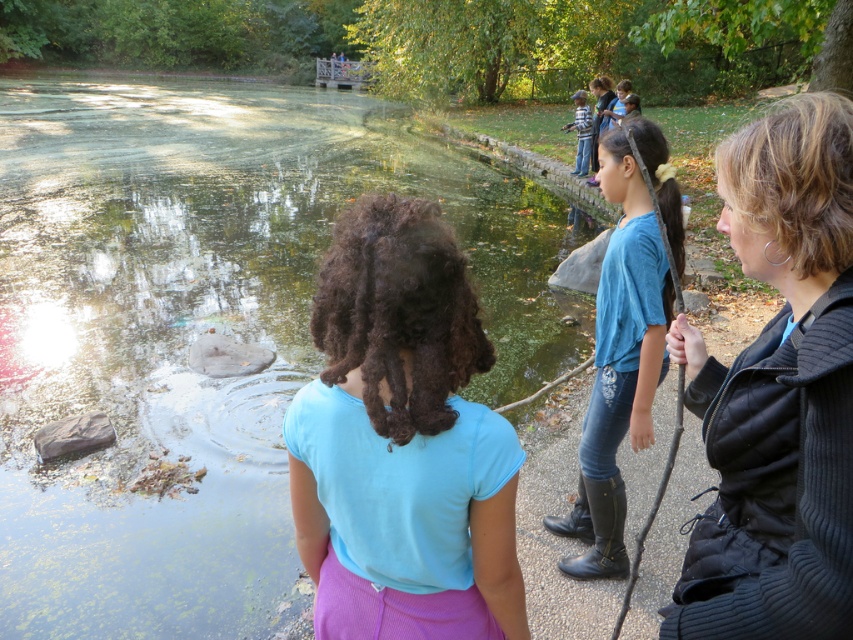
Question: Which object is closer to the camera taking this photo?

Choices:
 (A) blue denim jeans at upper center
 (B) black fuzzy jacket at upper right

Answer: (B)

Question: Considering the relative positions of blue fabric shirt at center and blue denim jeans at upper right in the image provided, where is blue fabric shirt at center located with respect to blue denim jeans at upper right?

Choices:
 (A) above
 (B) below

Answer: (A)

Question: Observing the image, what is the correct spatial positioning of green algae-covered water at center in reference to blue denim jeans at upper center?

Choices:
 (A) above
 (B) below

Answer: (A)

Question: Which object appears farthest from the camera in this image?

Choices:
 (A) blue fabric shirt at center
 (B) green algae-covered water at center

Answer: (B)

Question: In this image, where is blue fabric shirt at center located relative to blue denim jeans at upper right?

Choices:
 (A) above
 (B) below

Answer: (A)

Question: Which point appears farthest from the camera in this image?

Choices:
 (A) (724, 586)
 (B) (468, 353)
 (C) (22, 515)

Answer: (C)